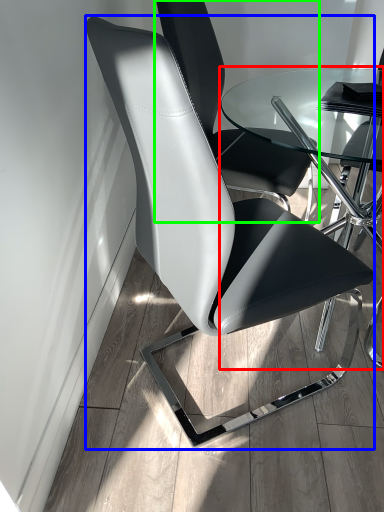
Question: Which object is the farthest from table (highlighted by a red box)? Choose among these: chair (highlighted by a blue box) or chair (highlighted by a green box).

Choices:
 (A) chair
 (B) chair

Answer: (A)